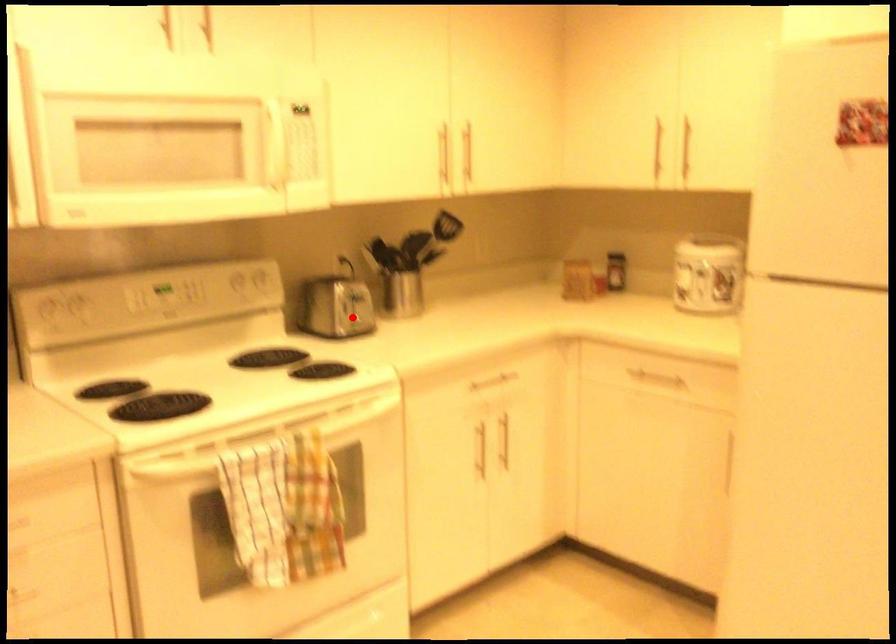
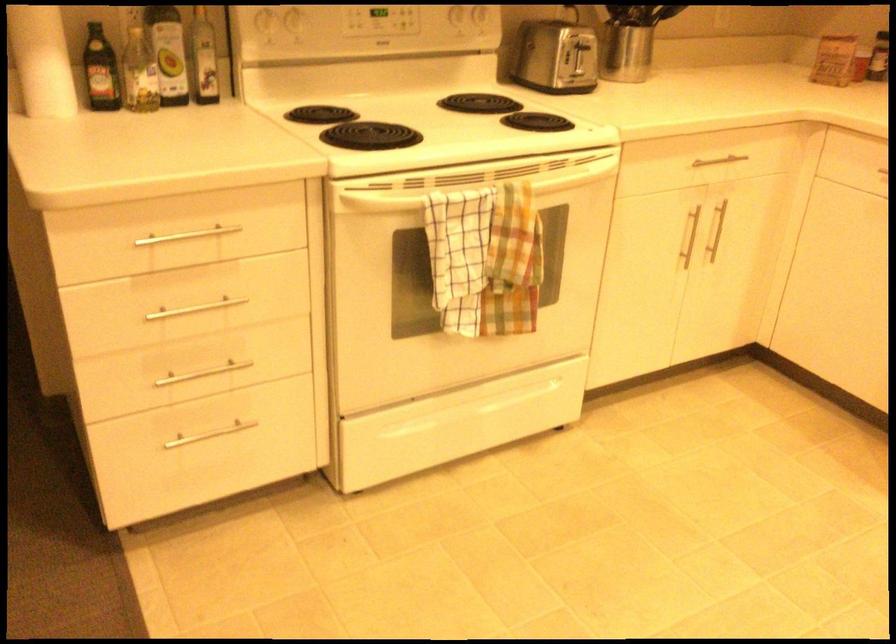
Find the pixel in the second image that matches the highlighted location in the first image.

(572, 73)